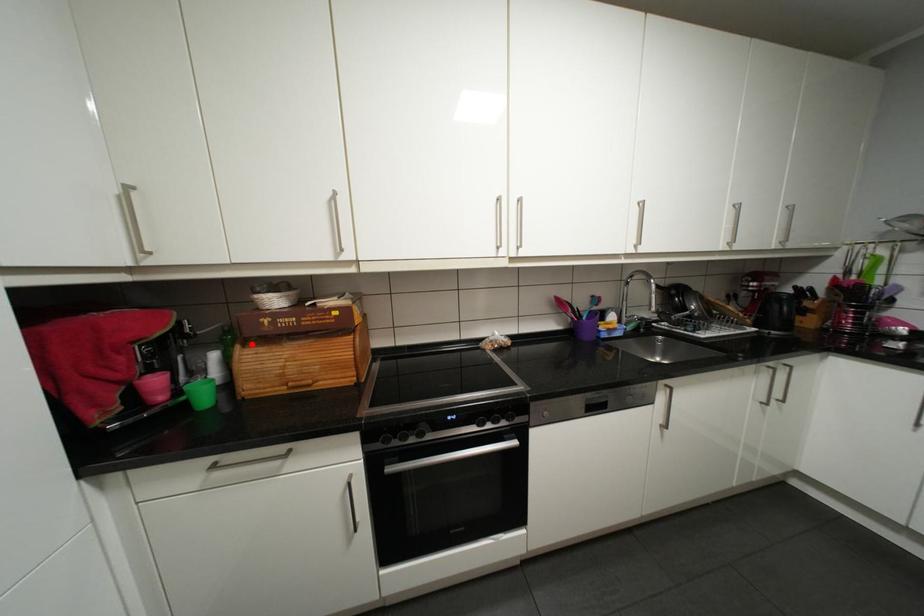
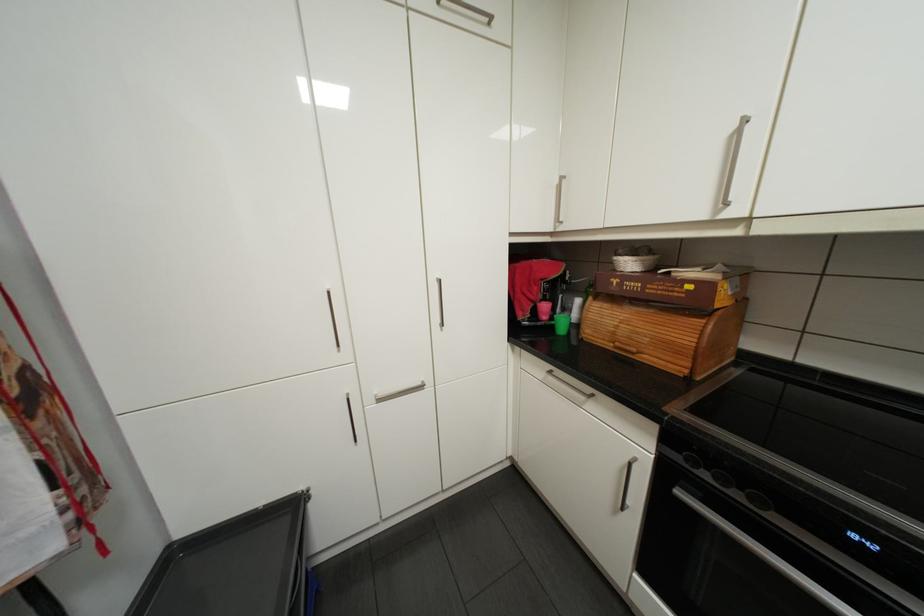
Question: A red point is marked in image1. In image2, is the corresponding 3D point closer to the camera or farther? Reply with the corresponding letter.

Choices:
 (A) The corresponding 3D point is closer.
 (B) The corresponding 3D point is farther.

Answer: (A)